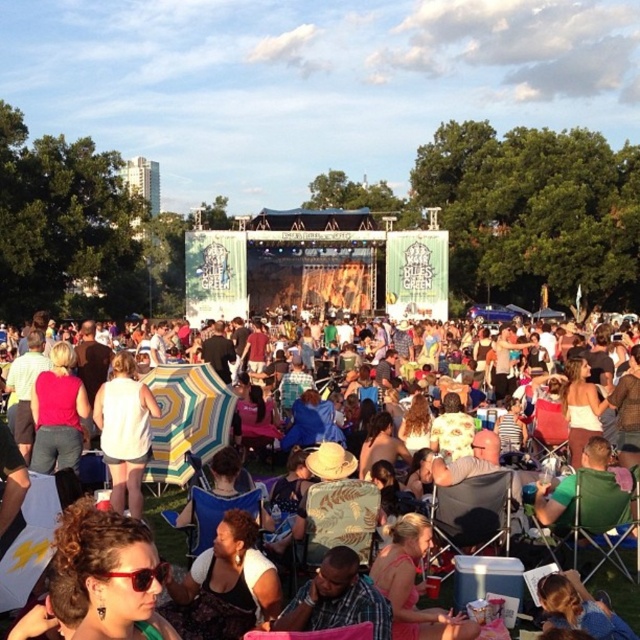
Question: Where is green leaf-patterned fabric chair at center located in relation to red plastic sunglasses at lower left in the image?

Choices:
 (A) above
 (B) below

Answer: (B)

Question: Which point is closer to the camera?

Choices:
 (A) white matte dress at center
 (B) red plastic sunglasses at lower left
 (C) multicolored fabric umbrella at center
 (D) green fabric chair at lower right

Answer: (B)

Question: Can you confirm if white fabric umbrella at lower left is wider than plastic folding chair at center?

Choices:
 (A) no
 (B) yes

Answer: (B)

Question: From the image, what is the correct spatial relationship of green leaf-patterned fabric chair at center in relation to green fabric chair at lower right?

Choices:
 (A) left
 (B) right

Answer: (A)

Question: Which object appears farthest from the camera in this image?

Choices:
 (A) multicolored fabric umbrella at center
 (B) plastic folding chair at center
 (C) red plastic sunglasses at lower left

Answer: (A)

Question: Which of these objects is positioned closest to the white matte dress at center?

Choices:
 (A) green fabric chair at lower right
 (B) multicolored fabric umbrella at center
 (C) plastic folding chair at center

Answer: (B)